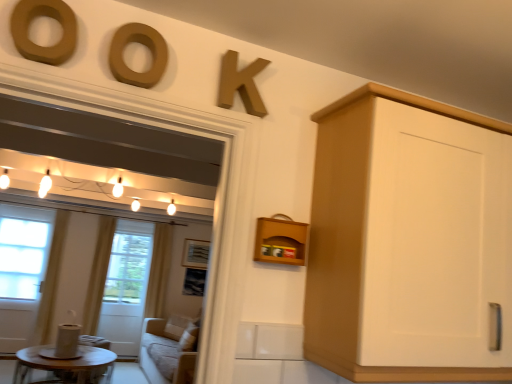
Question: From a real-world perspective, is matte wood letter at upper center, the second oval from the left, located beneath matte brown letter o at upper left, which is the 1th oval from left to right?

Choices:
 (A) no
 (B) yes

Answer: (B)

Question: Is matte wood letter at upper center, positioned as the 1th oval in right-to-left order, at the right side of matte brown letter o at upper left, which is the 1th oval from left to right?

Choices:
 (A) yes
 (B) no

Answer: (A)

Question: Is matte wood letter at upper center, the second oval from the left, next to matte brown letter o at upper left, which is the 1th oval from left to right, and touching it?

Choices:
 (A) no
 (B) yes

Answer: (A)

Question: Does matte wood letter at upper center, positioned as the 1th oval in right-to-left order, have a lesser width compared to matte brown letter o at upper left, which appears as the 2th oval when viewed from the right?

Choices:
 (A) yes
 (B) no

Answer: (A)

Question: Could you tell me if matte wood letter at upper center, the second oval from the left, is facing matte brown letter o at upper left, which is the 1th oval from left to right?

Choices:
 (A) no
 (B) yes

Answer: (A)

Question: Is matte wood letter at upper center, positioned as the 1th oval in right-to-left order, far away from matte brown letter o at upper left, which is the 1th oval from left to right?

Choices:
 (A) yes
 (B) no

Answer: (B)

Question: Does yellow fabric curtain at left, the first curtain positioned from the right, come behind matte wood letter at upper center, the second oval from the left?

Choices:
 (A) no
 (B) yes

Answer: (B)

Question: Does yellow fabric curtain at left, the first curtain positioned from the right, have a smaller size compared to matte wood letter at upper center, positioned as the 1th oval in right-to-left order?

Choices:
 (A) yes
 (B) no

Answer: (B)

Question: From a real-world perspective, is yellow fabric curtain at left, the first curtain positioned from the right, below matte wood letter at upper center, positioned as the 1th oval in right-to-left order?

Choices:
 (A) no
 (B) yes

Answer: (B)

Question: Is yellow fabric curtain at left, the third curtain viewed from the left, aimed at matte wood letter at upper center, positioned as the 1th oval in right-to-left order?

Choices:
 (A) yes
 (B) no

Answer: (B)

Question: Is the surface of yellow fabric curtain at left, the third curtain viewed from the left, in direct contact with matte wood letter at upper center, the second oval from the left?

Choices:
 (A) yes
 (B) no

Answer: (B)

Question: From a real-world perspective, is yellow fabric curtain at left, the third curtain viewed from the left, physically above matte wood letter at upper center, positioned as the 1th oval in right-to-left order?

Choices:
 (A) no
 (B) yes

Answer: (A)

Question: Is white glass screen door at left oriented towards wooden picture frame at center?

Choices:
 (A) no
 (B) yes

Answer: (A)